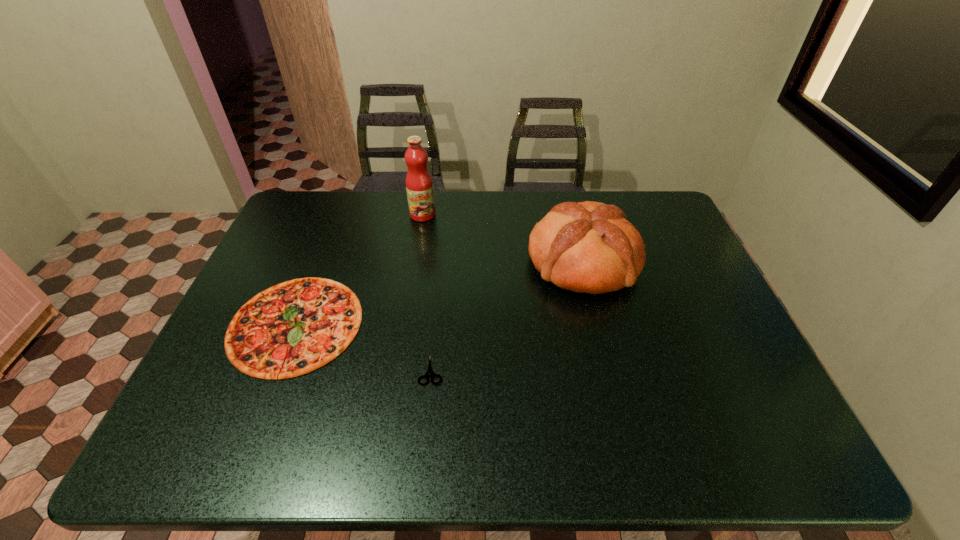
The image size is (960, 540). Identify the location of vacant space located 0.130m on the front of the third tallest object. (253, 432).

Where is `free space located on the back of the shears`? The height and width of the screenshot is (540, 960). free space located on the back of the shears is located at coordinates click(442, 253).

You are a GUI agent. You are given a task and a screenshot of the screen. Output one action in this format:
    pyautogui.click(x=<x>, y=<y>)
    Task: Click on the fruit juice at the far edge
    The height and width of the screenshot is (540, 960).
    Given the screenshot: What is the action you would take?
    pyautogui.click(x=419, y=185)

Locate an element on the screen. The height and width of the screenshot is (540, 960). bread present at the far edge is located at coordinates (589, 247).

Locate an element on the screen. The height and width of the screenshot is (540, 960). object that is at the left edge is located at coordinates (297, 326).

At what (x,y) coordinates should I click in order to perform the action: click on vacant space at the far edge. Please return your answer as a coordinate pair (x, y). This screenshot has height=540, width=960. Looking at the image, I should click on point(462,204).

Image resolution: width=960 pixels, height=540 pixels. In the image, there is a desktop. In order to click on vacant region at the near edge in this screenshot , I will do `click(305, 459)`.

In the image, there is a desktop. Identify the location of vacant space at the left edge. This screenshot has width=960, height=540. (307, 240).

Image resolution: width=960 pixels, height=540 pixels. In the image, there is a desktop. What are the coordinates of `vacant space at the right edge` in the screenshot? It's located at (664, 233).

In the image, there is a desktop. At what (x,y) coordinates should I click in order to perform the action: click on vacant region at the far left corner. Please return your answer as a coordinate pair (x, y). This screenshot has width=960, height=540. Looking at the image, I should click on (318, 190).